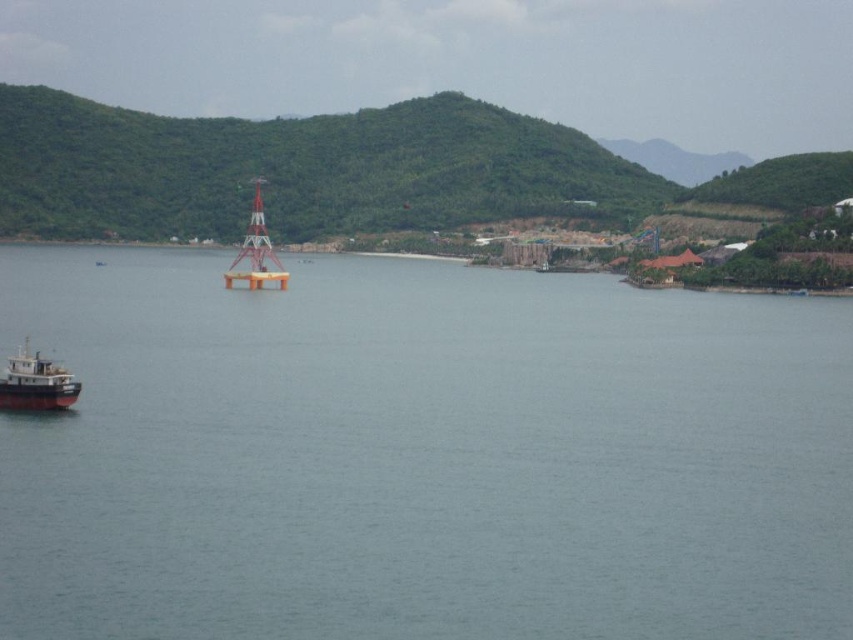
Question: Can you confirm if transparent water at center is positioned below brown matte boat at lower left?

Choices:
 (A) yes
 (B) no

Answer: (B)

Question: Is transparent water at center behind brown matte boat at lower left?

Choices:
 (A) no
 (B) yes

Answer: (A)

Question: Which object appears closest to the camera in this image?

Choices:
 (A) transparent water at center
 (B) brown matte boat at lower left

Answer: (A)

Question: Can you confirm if transparent water at center is bigger than brown matte boat at lower left?

Choices:
 (A) no
 (B) yes

Answer: (B)